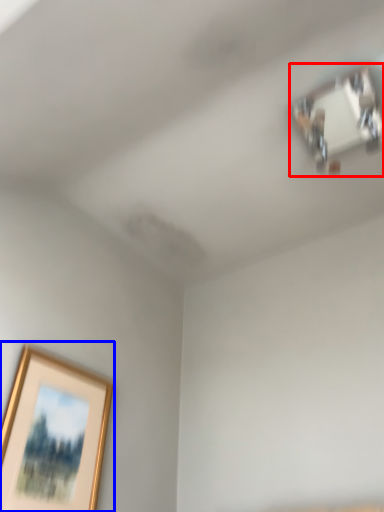
Question: Which object is further to the camera taking this photo, wide (highlighted by a red box) or picture frame (highlighted by a blue box)?

Choices:
 (A) wide
 (B) picture frame

Answer: (A)